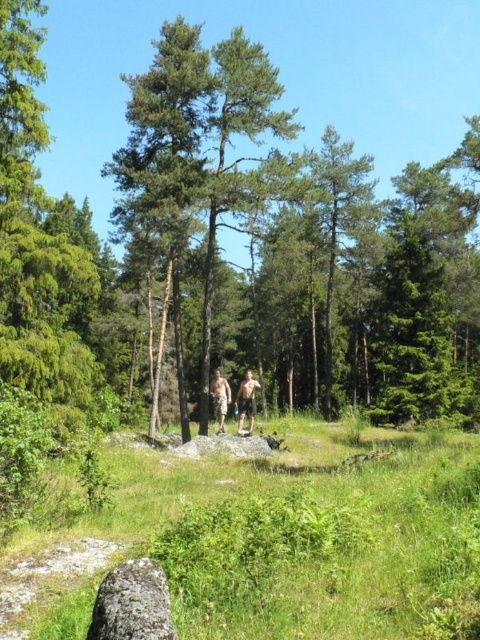
You are a photographer trying to capture a photo of the camouflage shorts at center without the gray rough rock at lower left appearing in the frame. Based on their positions, is this possible?

The gray rough rock at lower left is in front of the camouflage shorts at center, so it would block the view of the camouflage shorts at center. Therefore, you cannot take a photo of the camouflage shorts at center without the gray rough rock at lower left appearing in the frame.

You are planning to place a small potted plant on the gray rough rock at lower left. Considering the size of the rock, will the camouflage shorts at center fit on it?

The gray rough rock at lower left has a smaller size compared to camouflage shorts at center. Therefore, the camouflage shorts at center may not fit on the rock because the rock is smaller than the shorts.